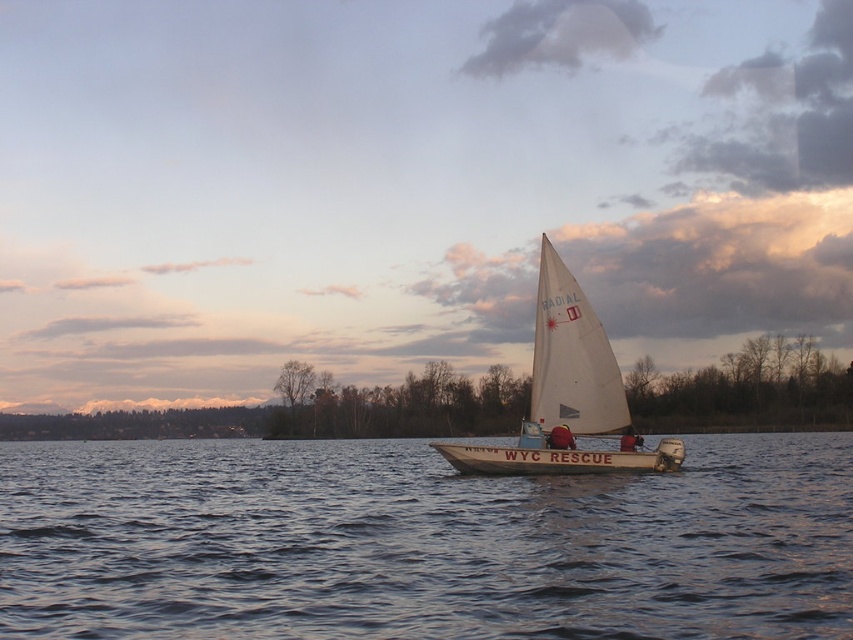
Question: Can you confirm if clear water at center is positioned to the left of white sailboat at center?

Choices:
 (A) no
 (B) yes

Answer: (B)

Question: Observing the image, what is the correct spatial positioning of clear water at center in reference to red fabric jacket at center?

Choices:
 (A) below
 (B) above

Answer: (A)

Question: Which of these objects is positioned farthest from the white sailboat at center?

Choices:
 (A) red fabric jacket at center
 (B) clear water at center

Answer: (B)

Question: Which of the following is the farthest from the observer?

Choices:
 (A) pos(627,445)
 (B) pos(347,566)

Answer: (A)

Question: Which of the following is the farthest from the observer?

Choices:
 (A) (602, 362)
 (B) (625, 444)
 (C) (84, 604)

Answer: (A)

Question: Is clear water at center thinner than red fabric jacket at center?

Choices:
 (A) no
 (B) yes

Answer: (A)